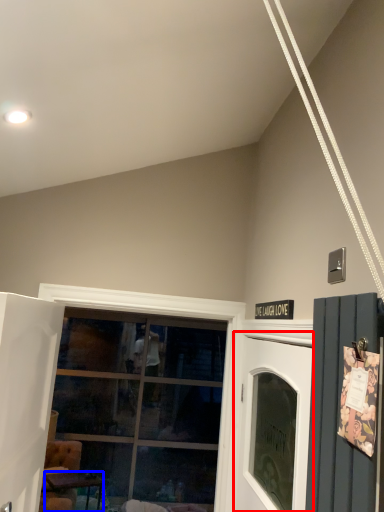
Question: Which point is closer to the camera, garage door (highlighted by a red box) or table (highlighted by a blue box)?

Choices:
 (A) garage door
 (B) table

Answer: (A)